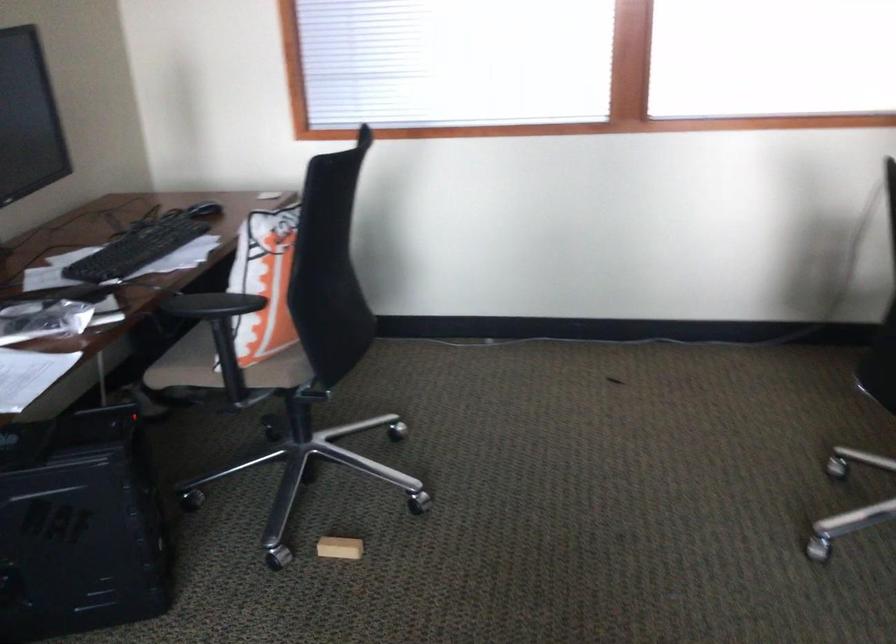
What do you see at coordinates (228, 370) in the screenshot?
I see `a chair sitting surface` at bounding box center [228, 370].